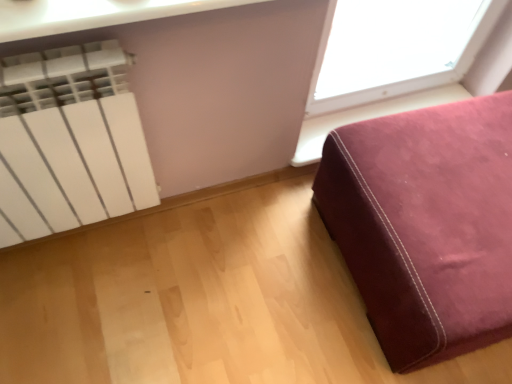
Question: Is the depth of white matte radiator at upper left greater than that of velvet-like burgundy ottoman at lower right?

Choices:
 (A) yes
 (B) no

Answer: (B)

Question: From the image's perspective, would you say white matte radiator at upper left is shown under velvet-like burgundy ottoman at lower right?

Choices:
 (A) no
 (B) yes

Answer: (A)

Question: Is white matte radiator at upper left facing towards velvet-like burgundy ottoman at lower right?

Choices:
 (A) no
 (B) yes

Answer: (A)

Question: Would you say white matte radiator at upper left contains velvet-like burgundy ottoman at lower right?

Choices:
 (A) no
 (B) yes

Answer: (A)

Question: Can you confirm if white matte radiator at upper left is positioned to the left of velvet-like burgundy ottoman at lower right?

Choices:
 (A) yes
 (B) no

Answer: (A)

Question: Is velvet-like burgundy ottoman at lower right at the back of white matte radiator at upper left?

Choices:
 (A) yes
 (B) no

Answer: (B)

Question: From the image's perspective, is velvet-like burgundy ottoman at lower right above white matte radiator at upper left?

Choices:
 (A) yes
 (B) no

Answer: (B)

Question: Considering the relative sizes of velvet-like burgundy ottoman at lower right and white matte radiator at upper left in the image provided, is velvet-like burgundy ottoman at lower right wider than white matte radiator at upper left?

Choices:
 (A) yes
 (B) no

Answer: (A)

Question: Is velvet-like burgundy ottoman at lower right to the right of white matte radiator at upper left from the viewer's perspective?

Choices:
 (A) yes
 (B) no

Answer: (A)

Question: Are velvet-like burgundy ottoman at lower right and white matte radiator at upper left located far from each other?

Choices:
 (A) yes
 (B) no

Answer: (B)

Question: Would you say velvet-like burgundy ottoman at lower right is outside white matte radiator at upper left?

Choices:
 (A) no
 (B) yes

Answer: (B)

Question: Can you confirm if velvet-like burgundy ottoman at lower right is positioned to the left of white matte radiator at upper left?

Choices:
 (A) yes
 (B) no

Answer: (B)

Question: Is velvet-like burgundy ottoman at lower right to the left or to the right of white matte radiator at upper left in the image?

Choices:
 (A) left
 (B) right

Answer: (B)